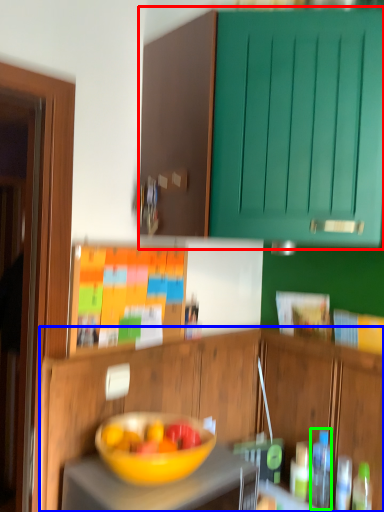
Question: Considering the real-world distances, which object is farthest from cabinetry (highlighted by a red box)? cabinetry (highlighted by a blue box) or bottle (highlighted by a green box)?

Choices:
 (A) cabinetry
 (B) bottle

Answer: (B)